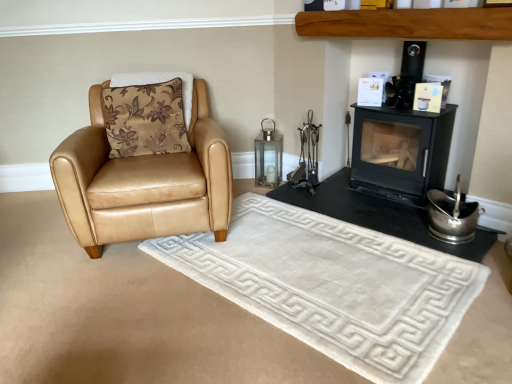
The width and height of the screenshot is (512, 384). I want to click on tan leather armchair at left, so click(143, 182).

Measure the distance between brown floral fabric pillow at left and camera.

brown floral fabric pillow at left and camera are 7.87 feet apart.

You are a GUI agent. You are given a task and a screenshot of the screen. Output one action in this format:
    pyautogui.click(x=<x>, y=<y>)
    Task: Click on the black matte wood burning stove at upper right
    
    Given the screenshot: What is the action you would take?
    pyautogui.click(x=400, y=152)

Between black matte fireplace at right and white plush rug at center, which one has smaller width?

black matte fireplace at right is thinner.

From the picture: Which of these two, black matte fireplace at right or white plush rug at center, stands shorter?

With less height is black matte fireplace at right.

Which is behind, black matte fireplace at right or white plush rug at center?

black matte fireplace at right is further from the camera.

You are a GUI agent. You are given a task and a screenshot of the screen. Output one action in this format:
    pyautogui.click(x=<x>, y=<y>)
    Task: Click on the table on the right of white plush rug at center
    
    Given the screenshot: What is the action you would take?
    pyautogui.click(x=379, y=214)

Is white plush rug at center not close to black matte wood burning stove at upper right?

They are positioned close to each other.

Is white plush rug at center facing towards black matte wood burning stove at upper right?

No, white plush rug at center is not oriented towards black matte wood burning stove at upper right.

Would you say white plush rug at center is outside black matte wood burning stove at upper right?

That's correct, white plush rug at center is outside of black matte wood burning stove at upper right.

Consider the image. From a real-world perspective, is brown floral fabric pillow at left positioned above or below black matte wood burning stove at upper right?

brown floral fabric pillow at left is situated higher than black matte wood burning stove at upper right in the real world.

Is brown floral fabric pillow at left situated inside black matte wood burning stove at upper right or outside?

A: brown floral fabric pillow at left is not inside black matte wood burning stove at upper right, it's outside.

Considering the positions of objects brown floral fabric pillow at left and black matte wood burning stove at upper right in the image provided, who is in front, brown floral fabric pillow at left or black matte wood burning stove at upper right?

black matte wood burning stove at upper right.

Considering the relative sizes of tan leather armchair at left and black matte wood burning stove at upper right in the image provided, is tan leather armchair at left wider than black matte wood burning stove at upper right?

Indeed, tan leather armchair at left has a greater width compared to black matte wood burning stove at upper right.

From the picture: Which of these two, tan leather armchair at left or black matte wood burning stove at upper right, stands taller?

With more height is black matte wood burning stove at upper right.

Which is in front, point (194, 121) or point (380, 116)?

The point (380, 116) is more forward.

From a real-world perspective, who is located lower, tan leather armchair at left or black matte wood burning stove at upper right?

tan leather armchair at left, from a real-world perspective.

From the image's perspective, is white plush rug at center positioned above or below brown floral fabric pillow at left?

Based on their image positions, white plush rug at center is located beneath brown floral fabric pillow at left.

This screenshot has width=512, height=384. What are the coordinates of `pillow behind the white plush rug at center` in the screenshot? It's located at point(145,119).

Which is in front, white plush rug at center or brown floral fabric pillow at left?

white plush rug at center is more forward.

Which of these two, white plush rug at center or brown floral fabric pillow at left, is smaller?

white plush rug at center.

Which point is more forward, (119, 131) or (351, 337)?

The point (351, 337) is closer to the camera.

In the scene shown: Which object is further away from the camera taking this photo, brown floral fabric pillow at left or white plush rug at center?

brown floral fabric pillow at left is behind.

Is brown floral fabric pillow at left to the right of white plush rug at center from the viewer's perspective?

Incorrect, brown floral fabric pillow at left is not on the right side of white plush rug at center.

Is white plush rug at center inside brown floral fabric pillow at left?

Actually, white plush rug at center is outside brown floral fabric pillow at left.

From a real-world perspective, is brown floral fabric pillow at left physically below black matte fireplace at right?

No, from a real-world perspective, brown floral fabric pillow at left is not beneath black matte fireplace at right.

Considering the sizes of brown floral fabric pillow at left and black matte fireplace at right in the image, is brown floral fabric pillow at left wider or thinner than black matte fireplace at right?

brown floral fabric pillow at left is thinner than black matte fireplace at right.

Which is more to the left, brown floral fabric pillow at left or black matte fireplace at right?

Positioned to the left is brown floral fabric pillow at left.

Identify the location of mat in front of the black matte fireplace at right. (333, 285).

Locate an element on the screen. mat that is on the left side of black matte wood burning stove at upper right is located at coordinates (333, 285).

Which object lies nearer to the anchor point tan leather armchair at left, white plush rug at center or black matte fireplace at right?

Based on the image, white plush rug at center appears to be nearer to tan leather armchair at left.

Looking at the image, which one is located closer to black matte wood burning stove at upper right, white plush rug at center or tan leather armchair at left?

Based on the image, white plush rug at center appears to be nearer to black matte wood burning stove at upper right.

Based on their spatial positions, is brown floral fabric pillow at left or white plush rug at center closer to black matte fireplace at right?

white plush rug at center.

In the scene shown: Considering their positions, is white plush rug at center positioned further to brown floral fabric pillow at left than black matte wood burning stove at upper right?

Based on the image, black matte wood burning stove at upper right appears to be further to brown floral fabric pillow at left.

Considering their positions, is black matte wood burning stove at upper right positioned closer to white plush rug at center than black matte fireplace at right?

black matte fireplace at right.

When comparing their distances from tan leather armchair at left, does white plush rug at center or black matte wood burning stove at upper right seem further?

black matte wood burning stove at upper right is further to tan leather armchair at left.

From the image, which object appears to be nearer to black matte fireplace at right, white plush rug at center or black matte wood burning stove at upper right?

Among the two, black matte wood burning stove at upper right is located nearer to black matte fireplace at right.

Which object lies further to the anchor point white plush rug at center, black matte fireplace at right or brown floral fabric pillow at left?

The object further to white plush rug at center is brown floral fabric pillow at left.

Where is `chair located between white plush rug at center and brown floral fabric pillow at left in the depth direction`? chair located between white plush rug at center and brown floral fabric pillow at left in the depth direction is located at coordinates (143, 182).

Find the location of `mat located between tan leather armchair at left and black matte wood burning stove at upper right in the left-right direction`. mat located between tan leather armchair at left and black matte wood burning stove at upper right in the left-right direction is located at coordinates (333, 285).

At what (x,y) coordinates should I click in order to perform the action: click on table between white plush rug at center and black matte wood burning stove at upper right along the z-axis. Please return your answer as a coordinate pair (x, y). Looking at the image, I should click on (379, 214).

Find the location of a particular element. table located between tan leather armchair at left and black matte wood burning stove at upper right in the left-right direction is located at coordinates (379, 214).